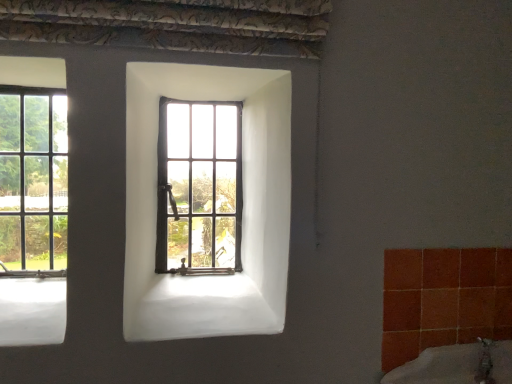
Question: Does wooden-framed window at center, which is counted as the first window, starting from the right, come behind white ceramic bath at lower right?

Choices:
 (A) no
 (B) yes

Answer: (B)

Question: Is wooden-framed window at center, the 2th window when ordered from left to right, next to white ceramic bath at lower right and touching it?

Choices:
 (A) no
 (B) yes

Answer: (A)

Question: Is wooden-framed window at center, which is counted as the first window, starting from the right, completely or partially outside of white ceramic bath at lower right?

Choices:
 (A) yes
 (B) no

Answer: (A)

Question: Does wooden-framed window at center, the 2th window when ordered from left to right, have a lesser width compared to white ceramic bath at lower right?

Choices:
 (A) yes
 (B) no

Answer: (A)

Question: From the image's perspective, does wooden-framed window at center, which is counted as the first window, starting from the right, appear lower than white ceramic bath at lower right?

Choices:
 (A) yes
 (B) no

Answer: (B)

Question: Can you confirm if wooden-framed window at center, which is counted as the first window, starting from the right, is shorter than white ceramic bath at lower right?

Choices:
 (A) yes
 (B) no

Answer: (B)

Question: Is clear glass window at left, the 1th window in the left-to-right sequence, at the left side of wooden-framed window at center, the 2th window when ordered from left to right?

Choices:
 (A) yes
 (B) no

Answer: (A)

Question: Does clear glass window at left, the 1th window in the left-to-right sequence, touch wooden-framed window at center, which is counted as the first window, starting from the right?

Choices:
 (A) yes
 (B) no

Answer: (B)

Question: Is wooden-framed window at center, the 2th window when ordered from left to right, surrounded by clear glass window at left, placed as the second window when sorted from right to left?

Choices:
 (A) no
 (B) yes

Answer: (A)

Question: From a real-world perspective, is clear glass window at left, the 1th window in the left-to-right sequence, beneath wooden-framed window at center, which is counted as the first window, starting from the right?

Choices:
 (A) no
 (B) yes

Answer: (A)

Question: Is clear glass window at left, the 1th window in the left-to-right sequence, positioned with its back to wooden-framed window at center, the 2th window when ordered from left to right?

Choices:
 (A) no
 (B) yes

Answer: (A)

Question: From a real-world perspective, is clear glass window at left, placed as the second window when sorted from right to left, positioned over wooden-framed window at center, the 2th window when ordered from left to right, based on gravity?

Choices:
 (A) no
 (B) yes

Answer: (B)

Question: From a real-world perspective, is white ceramic bath at lower right beneath clear glass window at left, placed as the second window when sorted from right to left?

Choices:
 (A) no
 (B) yes

Answer: (B)